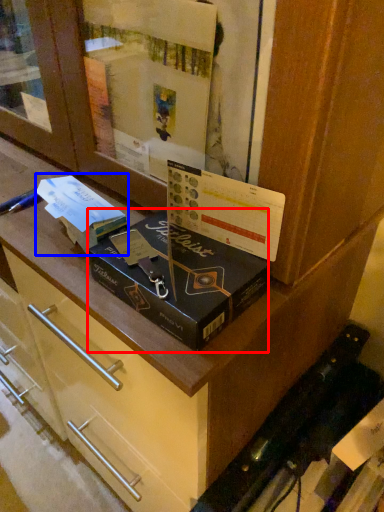
Question: Which object appears closest to the camera in this image, box (highlighted by a red box) or book (highlighted by a blue box)?

Choices:
 (A) box
 (B) book

Answer: (A)